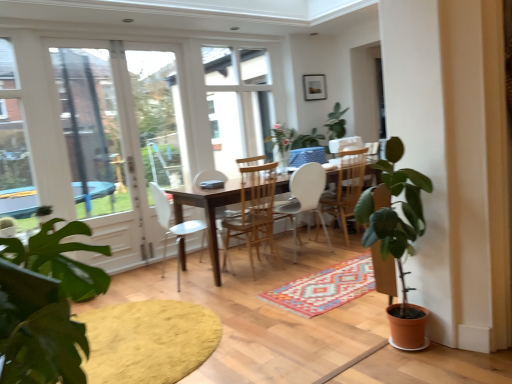
You are a GUI agent. You are given a task and a screenshot of the screen. Output one action in this format:
    pyautogui.click(x=<x>, y=<y>)
    Task: Click on the vacant region under yellow felt mat at lower center (from a real-world perspective)
    
    Given the screenshot: What is the action you would take?
    pyautogui.click(x=154, y=332)